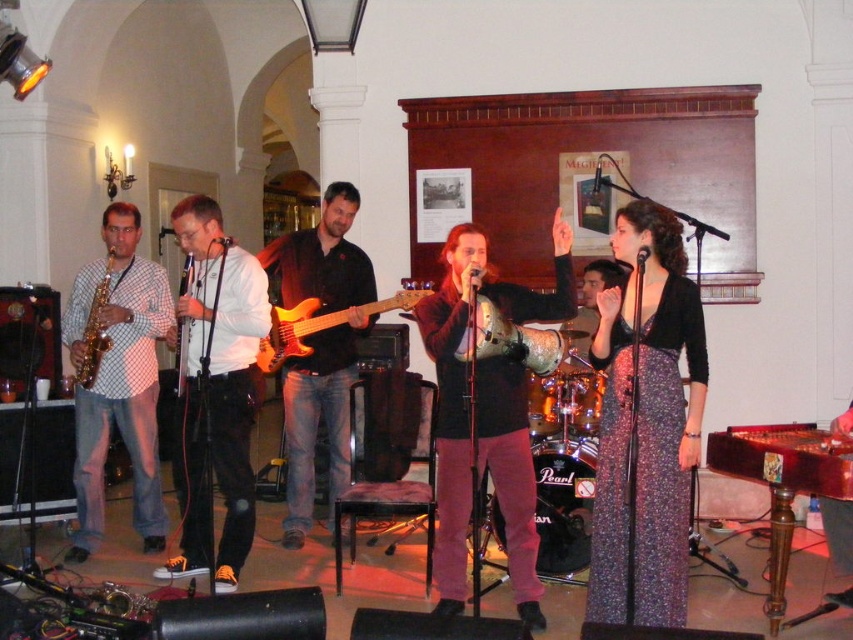
Question: Does matte black saxophone at left come behind metallic silver tambourine at center?

Choices:
 (A) no
 (B) yes

Answer: (A)

Question: Which object appears closest to the camera in this image?

Choices:
 (A) gold shiny saxophone at left
 (B) brown leather guitar at center

Answer: (A)

Question: Which point is closer to the camera?

Choices:
 (A) (334, 246)
 (B) (662, 433)

Answer: (B)

Question: Is shiny gold trumpet at center closer to the viewer compared to wooden electric guitar at center?

Choices:
 (A) no
 (B) yes

Answer: (B)

Question: Where is printed fabric dress at center located in relation to brown leather guitar at center in the image?

Choices:
 (A) above
 (B) below

Answer: (B)

Question: Which of these objects is positioned farthest from the brown leather guitar at center?

Choices:
 (A) shiny gold trumpet at center
 (B) matte black saxophone at left
 (C) gold shiny saxophone at left
 (D) gold metallic saxophone at left

Answer: (A)